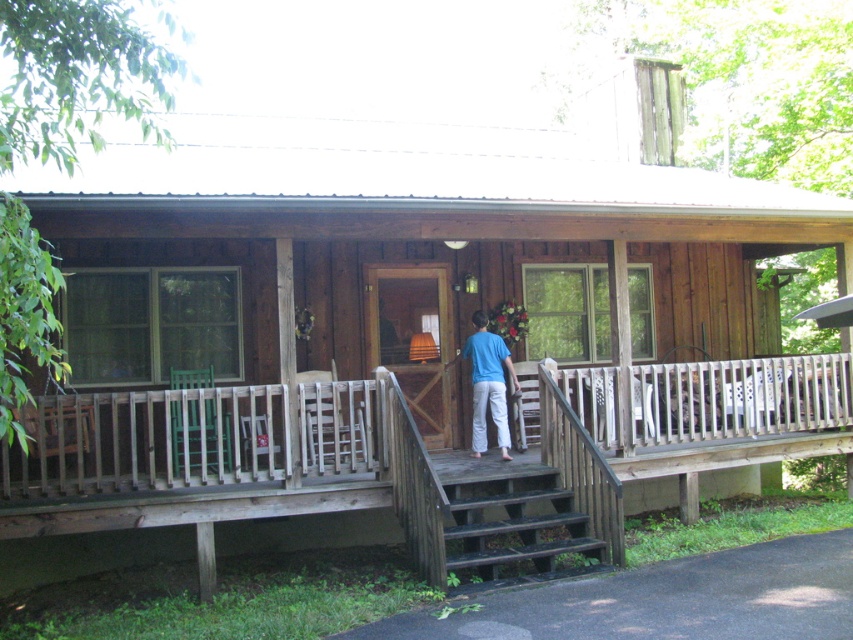
You are standing on the porch of the rustic wooden cabin and see two points marked on the ground. The first point is at coordinates point (294,422) and the second point is at point (456,358). Which point is closer to you as you face the cabin entrance?

Point (294,422) is in front of point (456,358), so it is closer to you as you face the cabin entrance.

You are a delivery person holding a package that requires a 4 feet clearance to maneuver safely. You are standing on the dark brown wooden stairs at center and need to move towards the blue cotton shirt at center. Can you safely move through the space between them without hitting the package?

The dark brown wooden stairs at center is 3.76 feet away from the blue cotton shirt at center. Since the required clearance is 4 feet, the distance is insufficient. You cannot safely move through the space between them without risking a collision.

You are planning to place a 1.5 meter wide bench on the wooden porch at center. The blue cotton shirt at center is currently occupying some space there. Can the bench fit on the porch if the shirt is moved?

The wooden porch at center might be wider than blue cotton shirt at center, so if the blue cotton shirt at center is moved, there might be enough space for the 1.5 meter wide bench.